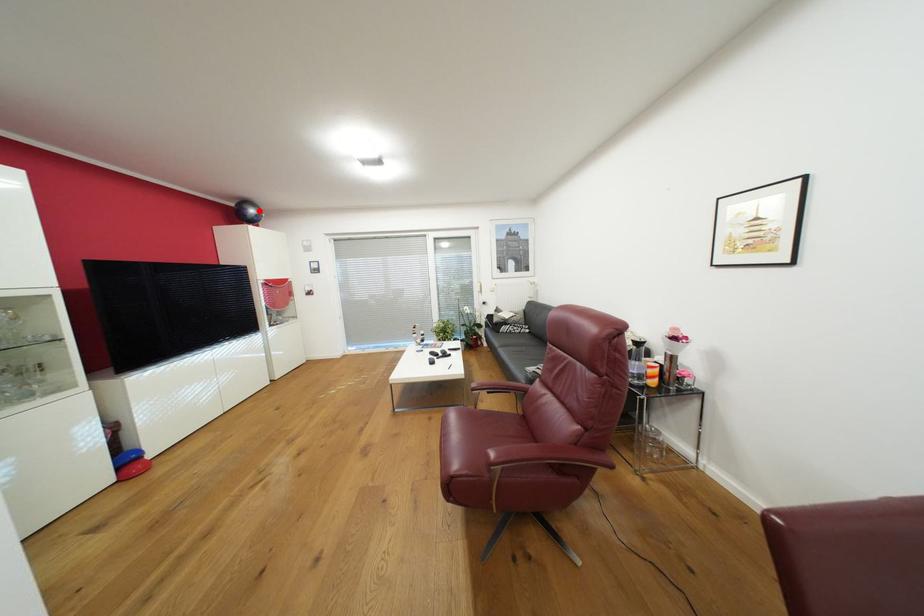
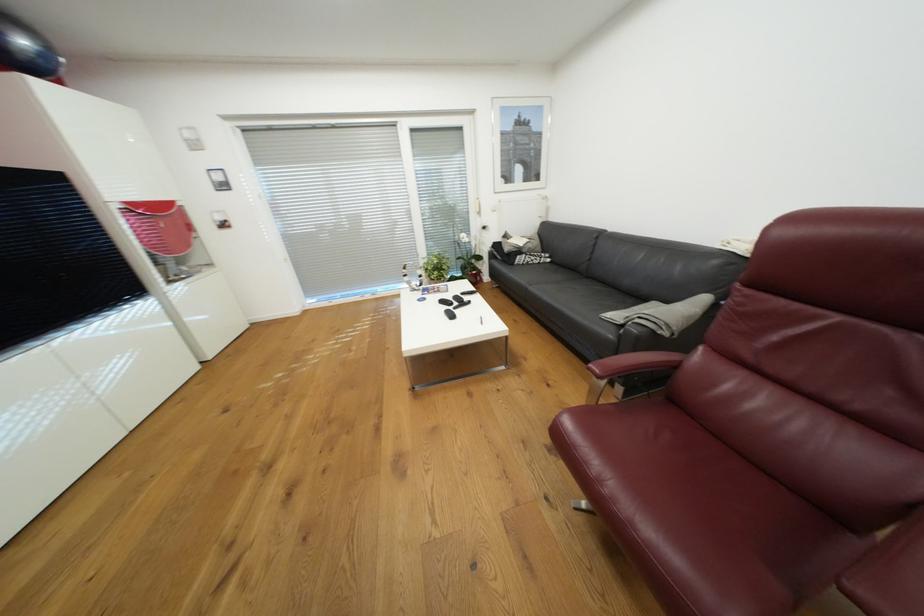
The point at the highlighted location is marked in the first image. Where is the corresponding point in the second image?

(29, 42)